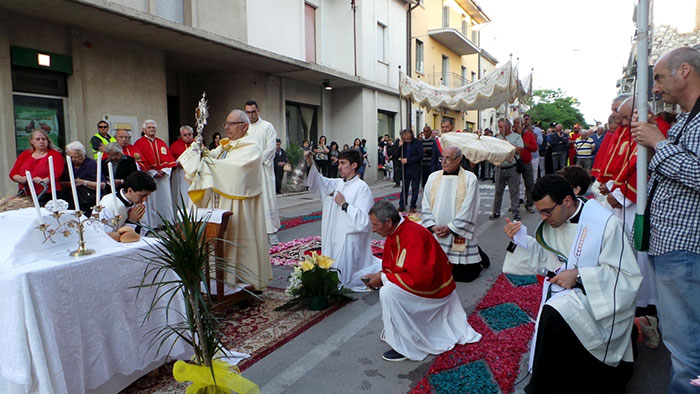
Find the location of a particular element. window is located at coordinates (416, 62).